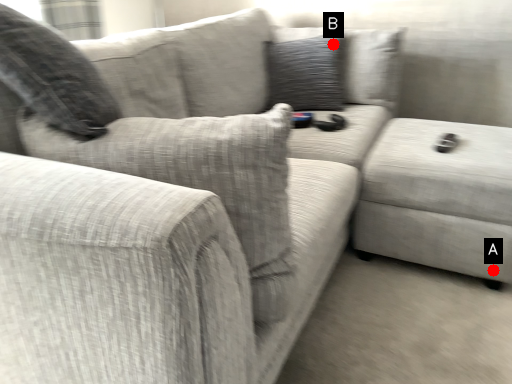
Question: Two points are circled on the image, labeled by A and B beside each circle. Among these points, which one is nearest to the camera?

Choices:
 (A) A is closer
 (B) B is closer

Answer: (A)